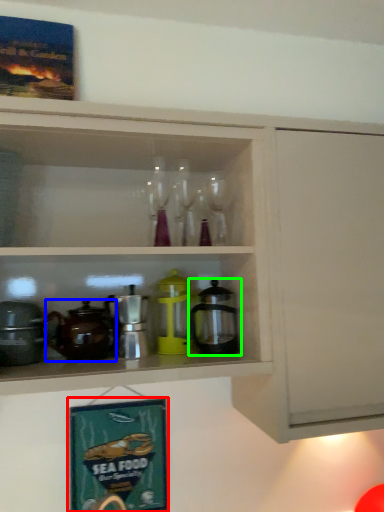
Question: Which is nearer to the picture frame (highlighted by a red box)? coffeepot (highlighted by a blue box) or coffeepot (highlighted by a green box).

Choices:
 (A) coffeepot
 (B) coffeepot

Answer: (A)